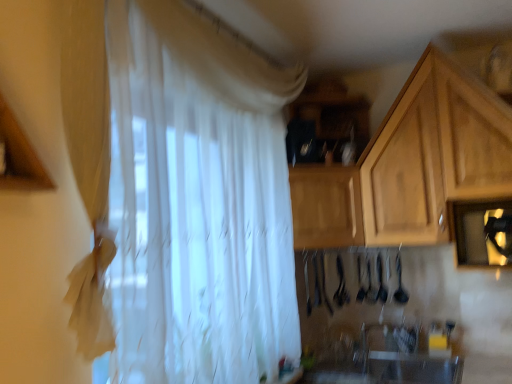
Question: In which direction should I rotate to look at wooden cabinet at center, which is counted as the 2th cabinetry, starting from the right?

Choices:
 (A) right
 (B) left

Answer: (A)

Question: Is white glossy sink at lower center next to wooden cabinet at upper right, which is counted as the 2th cabinetry, starting from the left?

Choices:
 (A) yes
 (B) no

Answer: (B)

Question: From a real-world perspective, does white glossy sink at lower center stand above wooden cabinet at upper right, which is counted as the 2th cabinetry, starting from the left?

Choices:
 (A) no
 (B) yes

Answer: (A)

Question: Can you confirm if white glossy sink at lower center is taller than wooden cabinet at upper right, which is counted as the 2th cabinetry, starting from the left?

Choices:
 (A) no
 (B) yes

Answer: (A)

Question: Does white glossy sink at lower center have a lesser height compared to wooden cabinet at upper right, which ranks as the first cabinetry in right-to-left order?

Choices:
 (A) yes
 (B) no

Answer: (A)

Question: Is there a large distance between white glossy sink at lower center and wooden cabinet at upper right, which is counted as the 2th cabinetry, starting from the left?

Choices:
 (A) no
 (B) yes

Answer: (A)

Question: Can wooden cabinet at upper right, which is counted as the 2th cabinetry, starting from the left, be found inside white glossy sink at lower center?

Choices:
 (A) yes
 (B) no

Answer: (B)

Question: Considering the relative sizes of wooden cabinet at center, the first cabinetry from the left, and wooden cabinet at upper right, which is counted as the 2th cabinetry, starting from the left, in the image provided, is wooden cabinet at center, the first cabinetry from the left, wider than wooden cabinet at upper right, which is counted as the 2th cabinetry, starting from the left,?

Choices:
 (A) yes
 (B) no

Answer: (B)

Question: Considering the relative sizes of wooden cabinet at center, the first cabinetry from the left, and wooden cabinet at upper right, which is counted as the 2th cabinetry, starting from the left, in the image provided, is wooden cabinet at center, the first cabinetry from the left, thinner than wooden cabinet at upper right, which is counted as the 2th cabinetry, starting from the left,?

Choices:
 (A) no
 (B) yes

Answer: (B)

Question: Is wooden cabinet at center, the first cabinetry from the left, bigger than wooden cabinet at upper right, which ranks as the first cabinetry in right-to-left order?

Choices:
 (A) yes
 (B) no

Answer: (B)

Question: Is wooden cabinet at center, which is counted as the 2th cabinetry, starting from the right, completely or partially outside of wooden cabinet at upper right, which ranks as the first cabinetry in right-to-left order?

Choices:
 (A) no
 (B) yes

Answer: (A)

Question: Does wooden cabinet at center, which is counted as the 2th cabinetry, starting from the right, turn towards wooden cabinet at upper right, which ranks as the first cabinetry in right-to-left order?

Choices:
 (A) yes
 (B) no

Answer: (A)

Question: Is wooden cabinet at center, the first cabinetry from the left, positioned with its back to wooden cabinet at upper right, which is counted as the 2th cabinetry, starting from the left?

Choices:
 (A) no
 (B) yes

Answer: (B)

Question: Can you confirm if white sheer curtain at center is taller than white glossy sink at lower center?

Choices:
 (A) no
 (B) yes

Answer: (B)